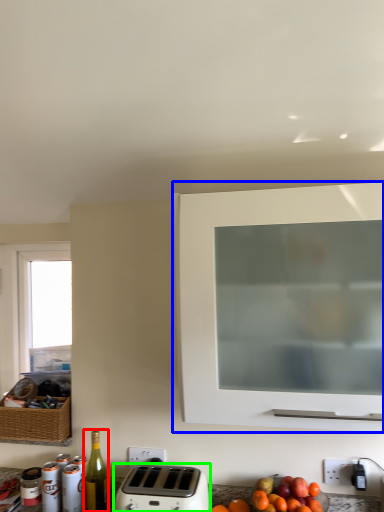
Question: Based on their relative distances, which object is farther from bottle (highlighted by a red box)? Choose from cabinetry (highlighted by a blue box) and toaster (highlighted by a green box).

Choices:
 (A) cabinetry
 (B) toaster

Answer: (A)